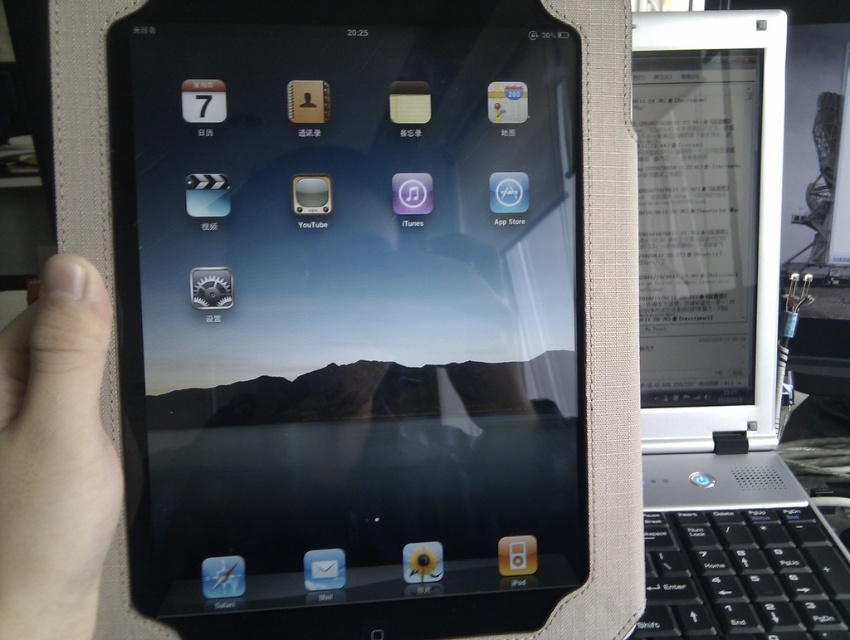
Is black matte tablet at center bigger than skinsmoothhand at left?

Correct, black matte tablet at center is larger in size than skinsmoothhand at left.

Based on the photo, does black matte tablet at center have a smaller size compared to skinsmoothhand at left?

Actually, black matte tablet at center might be larger than skinsmoothhand at left.

Where is `black matte tablet at center`? The height and width of the screenshot is (640, 850). black matte tablet at center is located at coordinates (347, 312).

Where is `black matte tablet at center`? This screenshot has width=850, height=640. black matte tablet at center is located at coordinates (347, 312).

Does point (259, 456) come farther from viewer compared to point (652, 232)?

No, it is in front of (652, 232).

Between point (201, 632) and point (700, 404), which one is positioned in front?

Point (201, 632) is more forward.

Is point (357, 100) positioned after point (649, 243)?

No.

Find the location of a particular element. black matte tablet at center is located at coordinates (347, 312).

Is black matte tablet at center wider than black plastic keyboard at lower right?

Correct, the width of black matte tablet at center exceeds that of black plastic keyboard at lower right.

Is point (411, 506) positioned behind point (717, 605)?

That is False.

Find the location of a particular element. The width and height of the screenshot is (850, 640). black matte tablet at center is located at coordinates (347, 312).